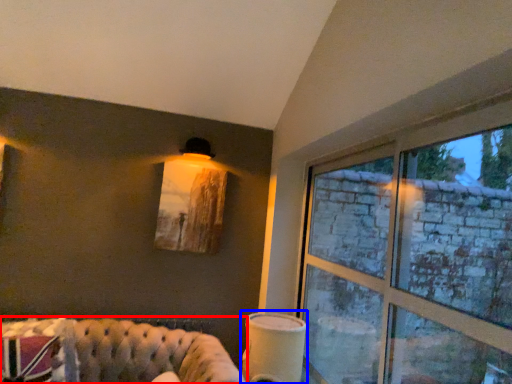
Question: Which object appears farthest to the camera in this image, studio couch (highlighted by a red box) or table lamp (highlighted by a blue box)?

Choices:
 (A) studio couch
 (B) table lamp

Answer: (B)